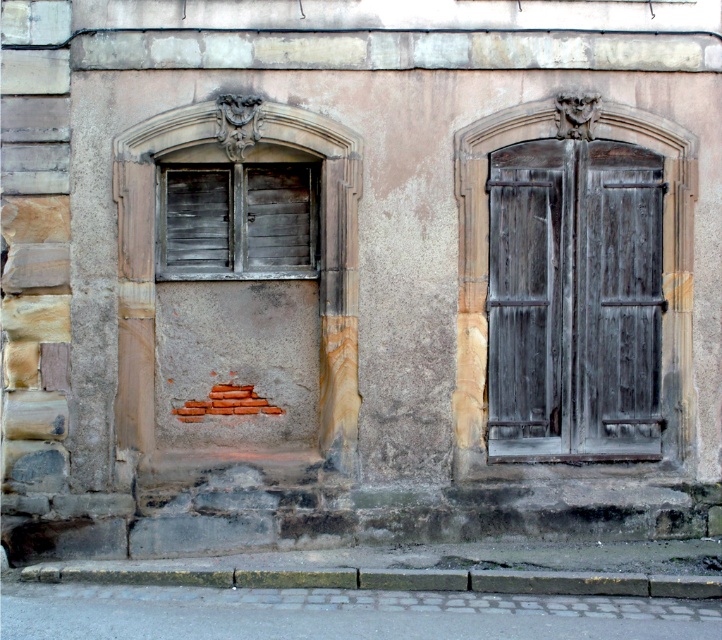
You are an architect examining the old building facade. You notice two sets of shutters. Which set, the dark gray wood shutters at center or the wooden shutters at left, would require more material to construct due to their size?

The dark gray wood shutters at center require more material because they are larger in size compared to the wooden shutters at left.

In the scene shown: You are a painter who needs to decide which object to paint first. The dark gray wood shutters at center and the gray concrete curb at lower center are both in your view. Based on their widths, which one should you tackle first if you want to start with the narrower object?

The dark gray wood shutters at center is thinner than the gray concrete curb at lower center, so you should paint the dark gray wood shutters at center first since it is narrower.

You are standing in front of an old building and notice the dark gray wood shutters at center and the gray concrete curb at lower center. Which object is closer to you?

The dark gray wood shutters at center are closer to you because they are further to the viewer than the gray concrete curb at lower center.